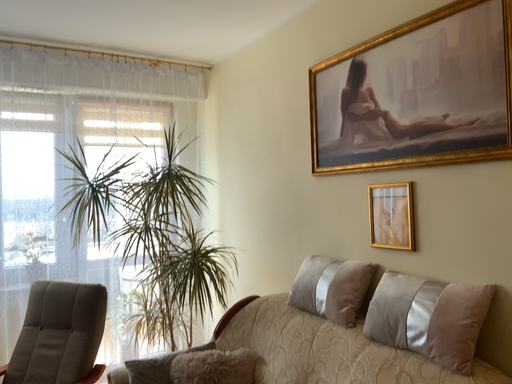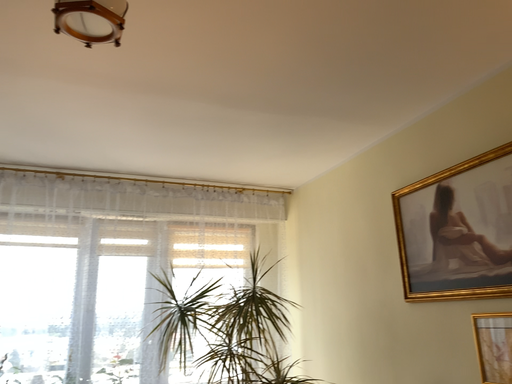
Question: Which way did the camera rotate in the video?

Choices:
 (A) rotated right
 (B) rotated left

Answer: (B)